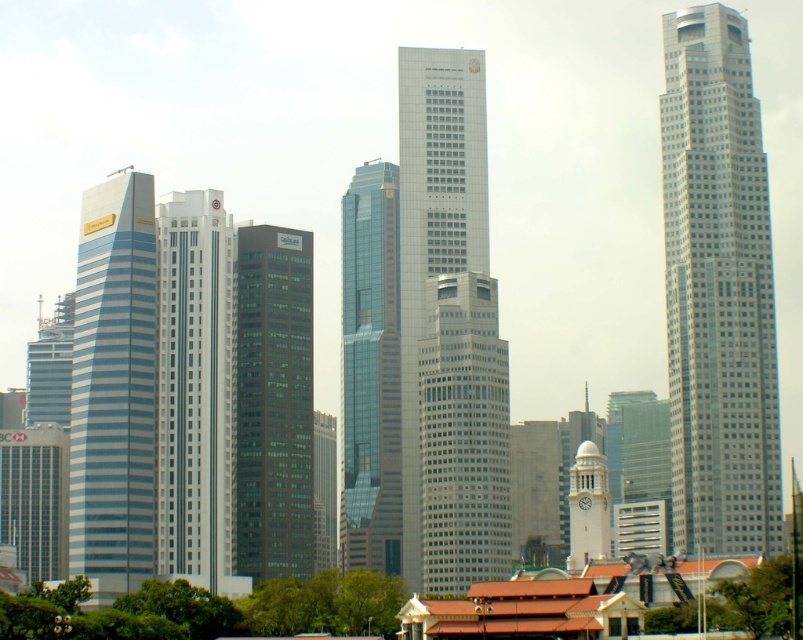
You are a drone operator tasked with flying a drone from the gray glass skyscraper at center to the white stone clock tower at center. Based on the scene description, can you determine if the drone will have a clear line of sight to fly directly between them?

The white stone clock tower at center is behind the gray glass skyscraper at center, so the drone will not have a clear line of sight to fly directly between them as the gray glass skyscraper at center blocks the path.

You are a drone operator tasked with capturing aerial footage of the city. Your drone has a maximum flight range of 1000 feet. If you are positioned at the camera location, can your drone reach the silver glass skyscraper at right without exceeding its range?

The distance of silver glass skyscraper at right from camera is 849.14 feet, which is within the drone operator drone maximum flight range of 1000 feet. Yes, the drone can reach the silver glass skyscraper at right without exceeding its range.

You are a photographer standing in the cityscape scene. You want to take a photo that includes both point (500, 577) and point (571, 468). Which point will appear closer to the bottom of the photo?

Point (571, 468) will appear closer to the bottom of the photo because it is closer to the camera than point (500, 577), which is further away.